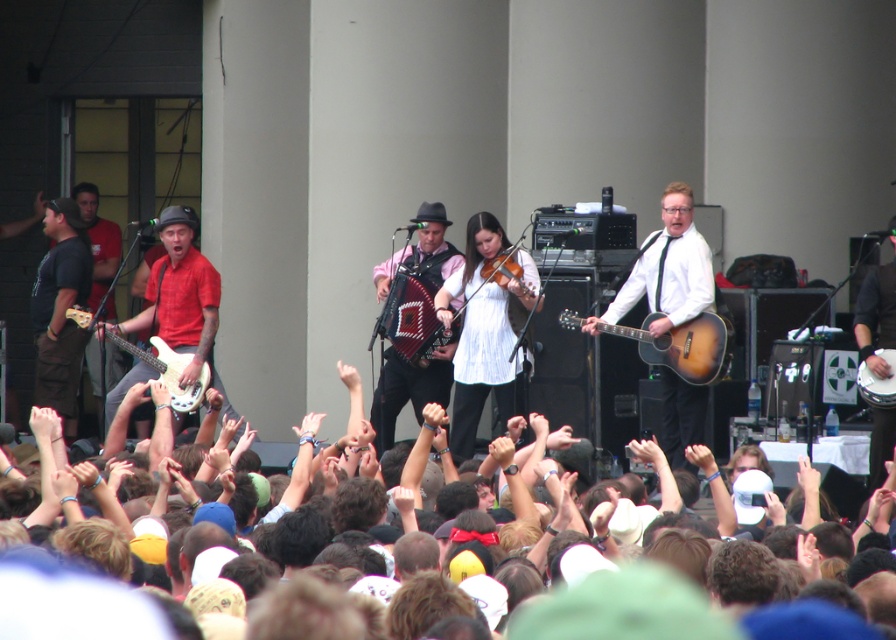
Measure the distance between white cotton crowd at center and camera.

The distance of white cotton crowd at center from camera is 25.93 meters.

Where is `white cotton crowd at center`? The width and height of the screenshot is (896, 640). white cotton crowd at center is located at coordinates click(x=672, y=612).

Is point (657, 609) farther from camera compared to point (892, 396)?

No, it is in front of (892, 396).

Identify the location of white cotton crowd at center. (672, 612).

Does matte pink shirt at center appear on the right side of white glossy electric guitar at left?

Yes, matte pink shirt at center is to the right of white glossy electric guitar at left.

Measure the distance between matte pink shirt at center and white glossy electric guitar at left.

matte pink shirt at center and white glossy electric guitar at left are 12.18 feet apart.

Who is more forward, (399,260) or (187,392)?

Point (187,392) is more forward.

At what (x,y) coordinates should I click in order to perform the action: click on matte pink shirt at center. Please return your answer as a coordinate pair (x, y). The height and width of the screenshot is (640, 896). Looking at the image, I should click on (408, 388).

Does matte brown guitar at center appear on the left side of knitted wool accordion at center?

Incorrect, matte brown guitar at center is not on the left side of knitted wool accordion at center.

How far apart are matte brown guitar at center and knitted wool accordion at center?

matte brown guitar at center is 4.04 meters away from knitted wool accordion at center.

Find the location of `matte brown guitar at center`. matte brown guitar at center is located at coordinates (668, 269).